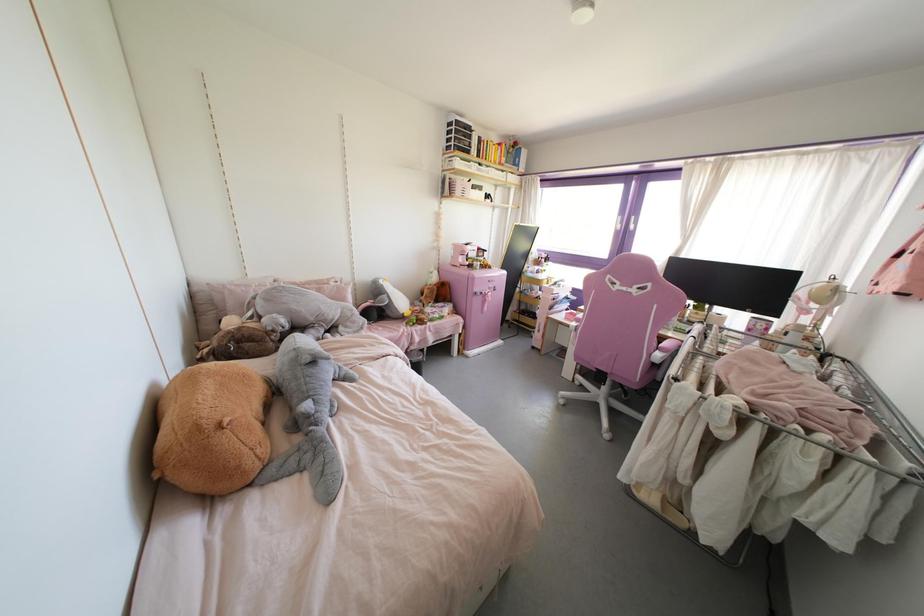
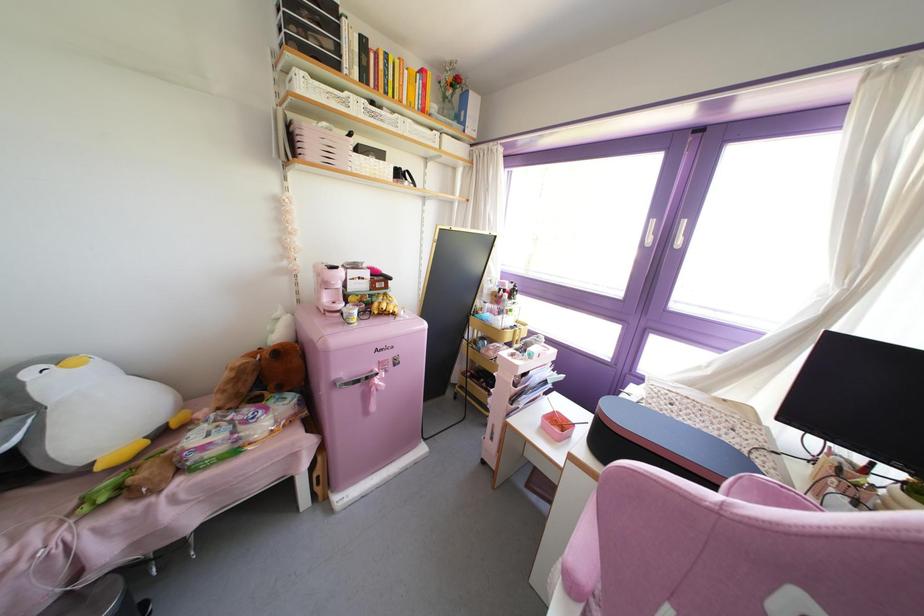
Locate, in the second image, the point that corresponds to [477,191] in the first image.

(371, 160)